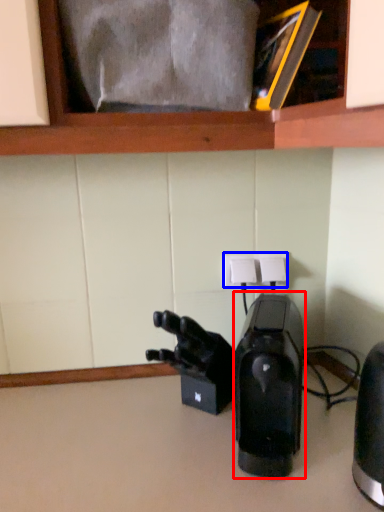
Question: Which object is further to the camera taking this photo, home appliance (highlighted by a red box) or electric outlet (highlighted by a blue box)?

Choices:
 (A) home appliance
 (B) electric outlet

Answer: (B)